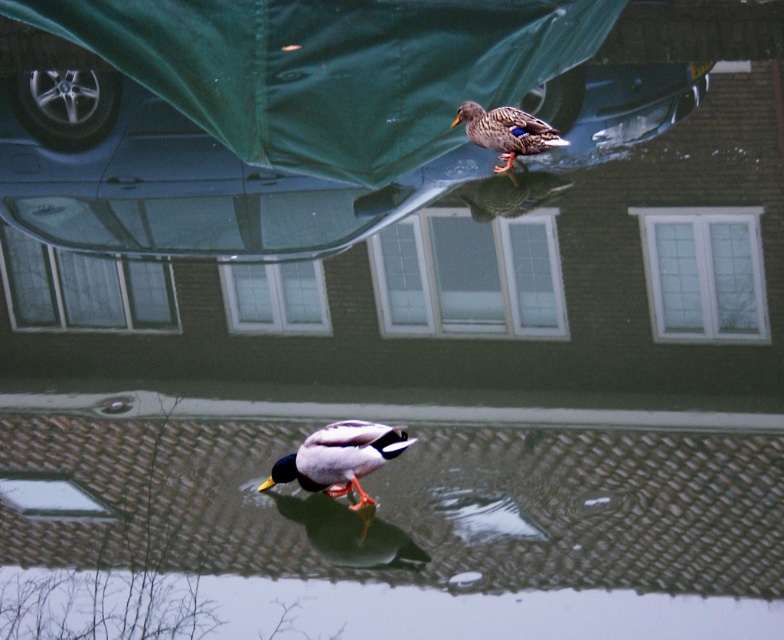
Between green glossy duck at center and matte brown duck at upper center, which one is positioned lower?

green glossy duck at center is lower down.

Where is `green glossy duck at center`? This screenshot has width=784, height=640. green glossy duck at center is located at coordinates (339, 458).

Does point (245, 112) lie in front of point (354, 483)?

No.

The width and height of the screenshot is (784, 640). Describe the element at coordinates (329, 67) in the screenshot. I see `metallic blue car at upper center` at that location.

Find the location of `metallic blue car at upper center`. metallic blue car at upper center is located at coordinates (329, 67).

Can you confirm if metallic blue car at upper center is shorter than matte brown duck at upper center?

No, metallic blue car at upper center is not shorter than matte brown duck at upper center.

Who is shorter, metallic blue car at upper center or matte brown duck at upper center?

matte brown duck at upper center is shorter.

Between point (162, 33) and point (459, 109), which one is positioned in front?

Point (459, 109) is in front.

Find the location of a particular element. metallic blue car at upper center is located at coordinates (329, 67).